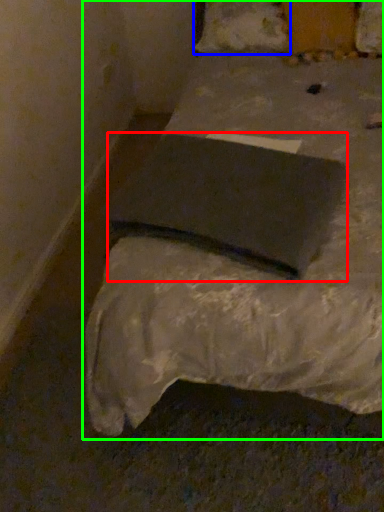
Question: Based on their relative distances, which object is nearer to pad (highlighted by a red box)? Choose from pillow (highlighted by a blue box) and bed (highlighted by a green box).

Choices:
 (A) pillow
 (B) bed

Answer: (B)